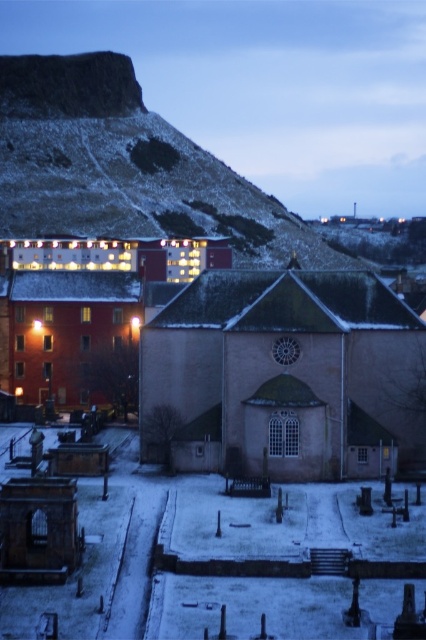
Between smooth stone church at center and matte brick church at center, which one has more height?

With more height is matte brick church at center.

Which is in front, point (287, 458) or point (66, 392)?

Positioned in front is point (287, 458).

What are the coordinates of `smooth stone church at center` in the screenshot? It's located at (284, 376).